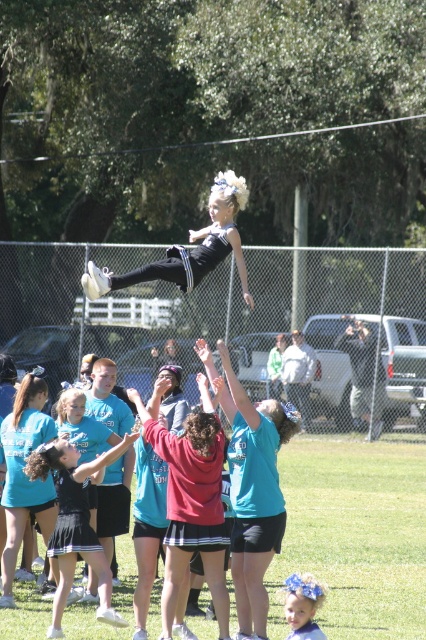
Describe the element at coordinates (354, 534) in the screenshot. This screenshot has width=426, height=640. I see `green grass football field at center` at that location.

Is green grass football field at center wider than black matte leotard at center?

Indeed, green grass football field at center has a greater width compared to black matte leotard at center.

Does point (379, 492) come farther from viewer compared to point (219, 257)?

Yes, it is.

Locate an element on the screen. The image size is (426, 640). green grass football field at center is located at coordinates (354, 534).